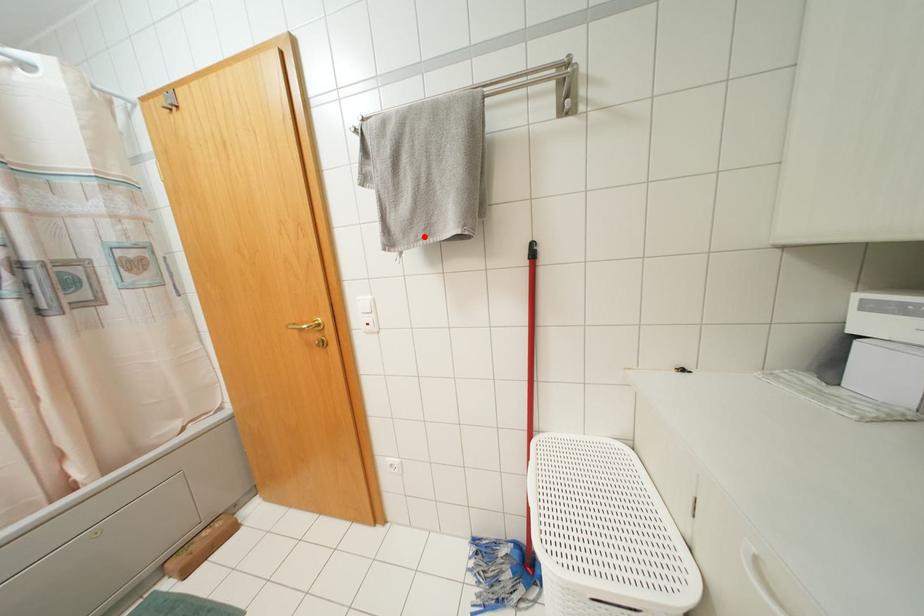
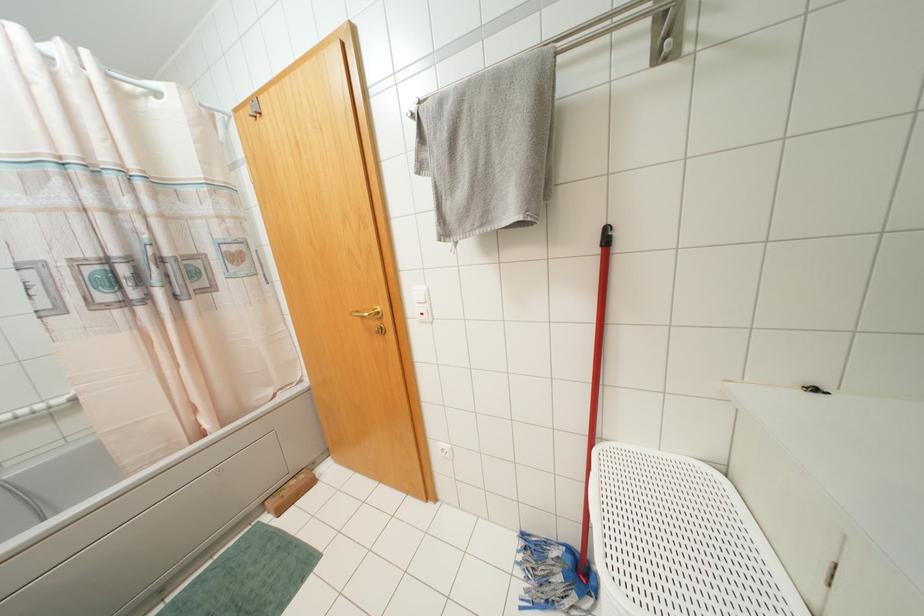
Find the pixel in the second image that matches the highlighted location in the first image.

(481, 225)